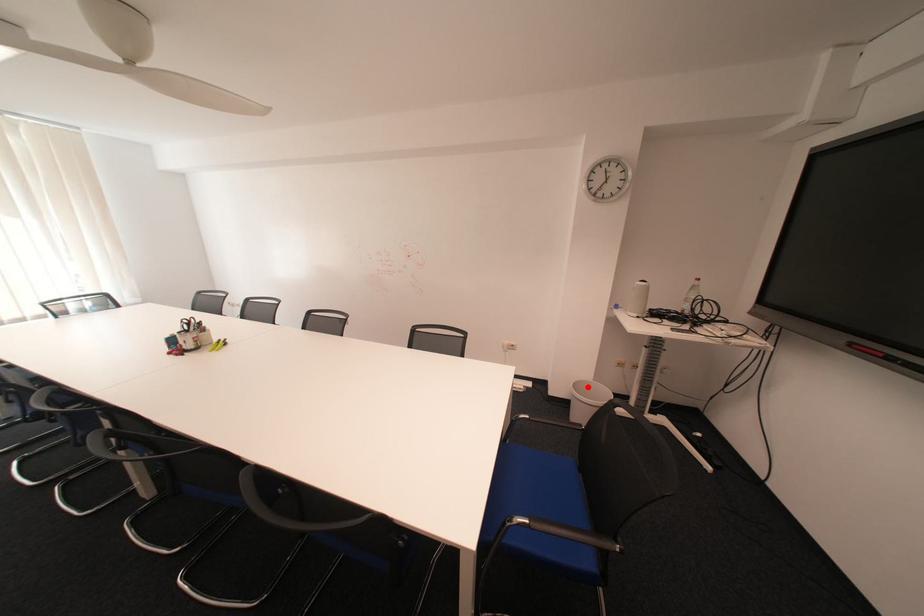
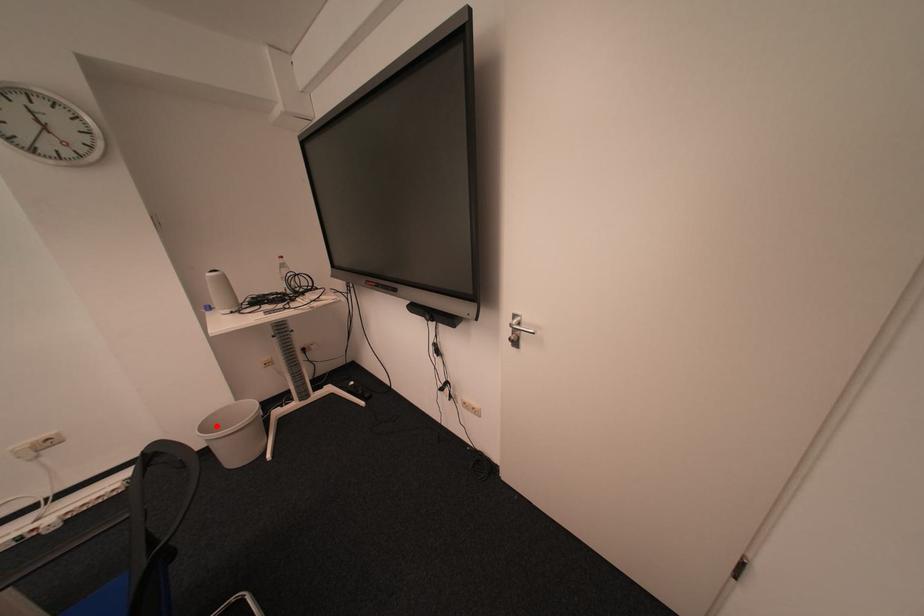
I am providing you with two images of the same scene from different viewpoints. A red point is marked on the first image and another point is marked on the second image. Does the point marked in image1 correspond to the same location as the one in image2?

Yes